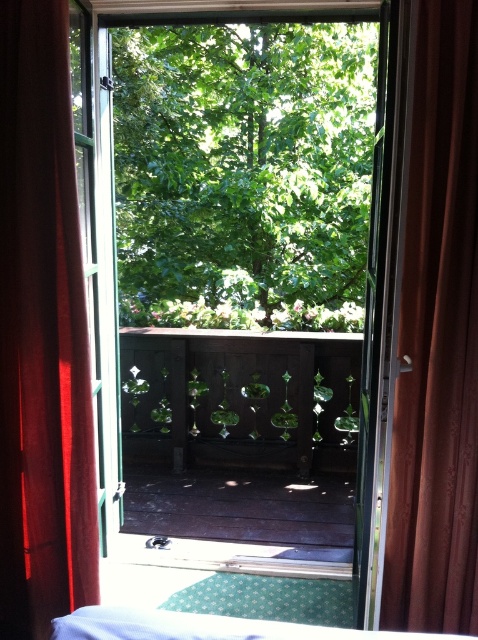
You are standing inside a room and looking through the open window. There is a point at coordinates (42, 333). What object is located at that point?

The point at coordinates (42, 333) corresponds to the red velvet curtain at left.

You are standing inside a room and looking through the open window. There is a brown velvet curtain at right. Can you see the decorative cutouts on the balcony railing through the window?

Yes, the decorative cutouts on the balcony railing are visible through the open window, as the brown velvet curtain at right is positioned at point [435,330], which does not obstruct the view of the balcony railing.